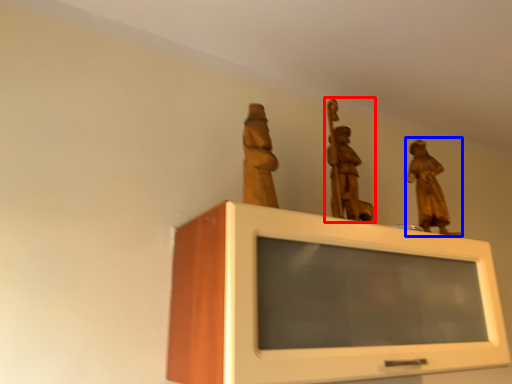
Question: Which point is closer to the camera, sculpture (highlighted by a red box) or sculpture (highlighted by a blue box)?

Choices:
 (A) sculpture
 (B) sculpture

Answer: (A)